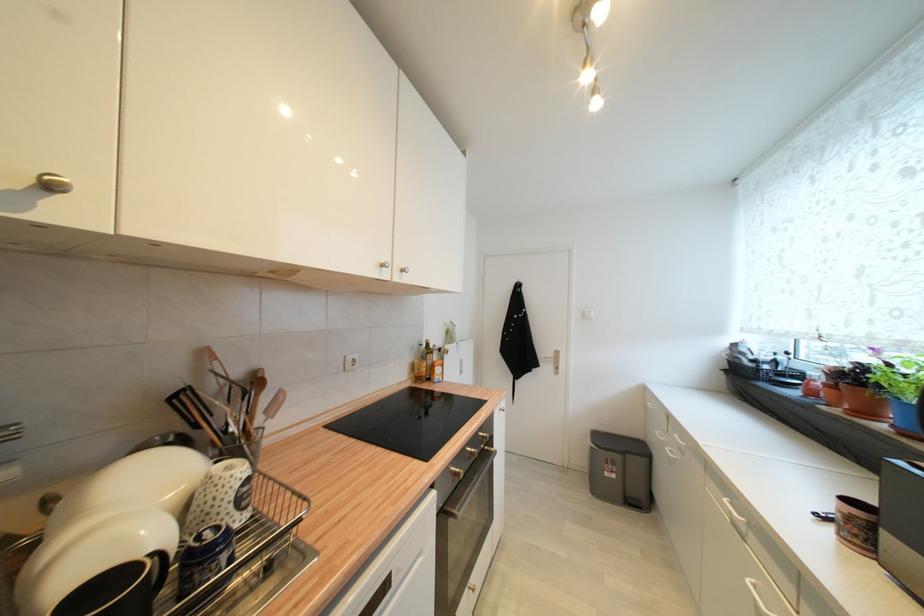
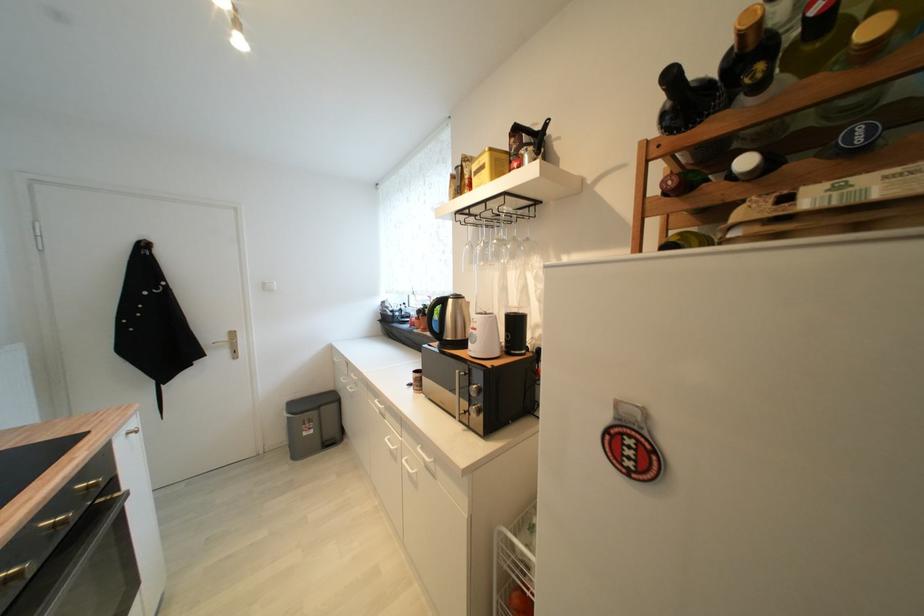
The point at (556, 358) is marked in the first image. Where is the corresponding point in the second image?

(229, 339)